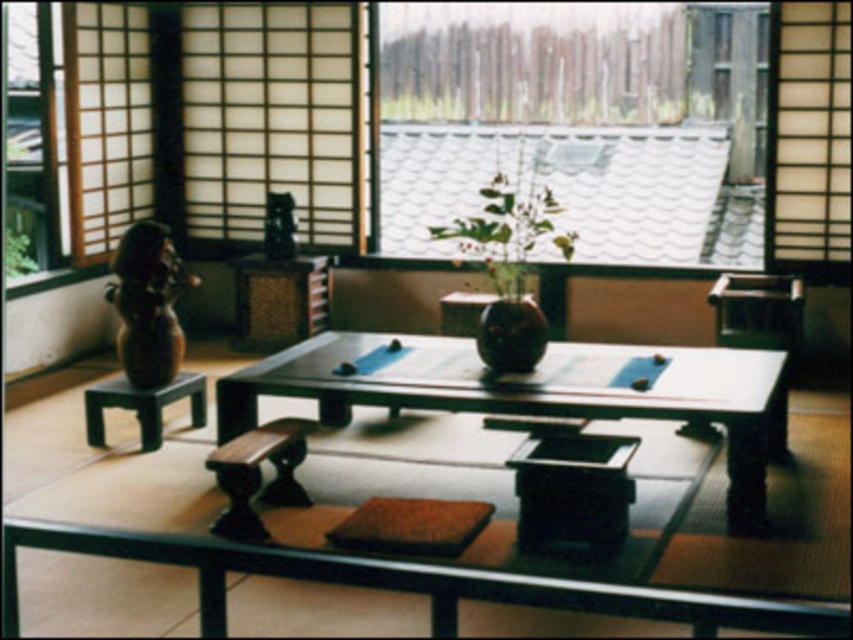
Is the position of smooth dark wood table at center less distant than that of matte brown vase at center?

Yes.

Where is `smooth dark wood table at center`? smooth dark wood table at center is located at coordinates (537, 392).

Where is `smooth dark wood table at center`? This screenshot has width=853, height=640. smooth dark wood table at center is located at coordinates (537, 392).

Looking at this image, is transparent glass window at upper center bigger than smooth dark wood table at center?

Indeed, transparent glass window at upper center has a larger size compared to smooth dark wood table at center.

Who is higher up, transparent glass window at upper center or smooth dark wood table at center?

Positioned higher is transparent glass window at upper center.

The width and height of the screenshot is (853, 640). Identify the location of transparent glass window at upper center. (271, 124).

The height and width of the screenshot is (640, 853). What are the coordinates of `transparent glass window at upper center` in the screenshot? It's located at (271, 124).

Is transparent glass window at upper center positioned at the back of matte brown vase at center?

That is True.

Does transparent glass window at upper center appear on the left side of matte brown vase at center?

Correct, you'll find transparent glass window at upper center to the left of matte brown vase at center.

This screenshot has height=640, width=853. What are the coordinates of `transparent glass window at upper center` in the screenshot? It's located at (271, 124).